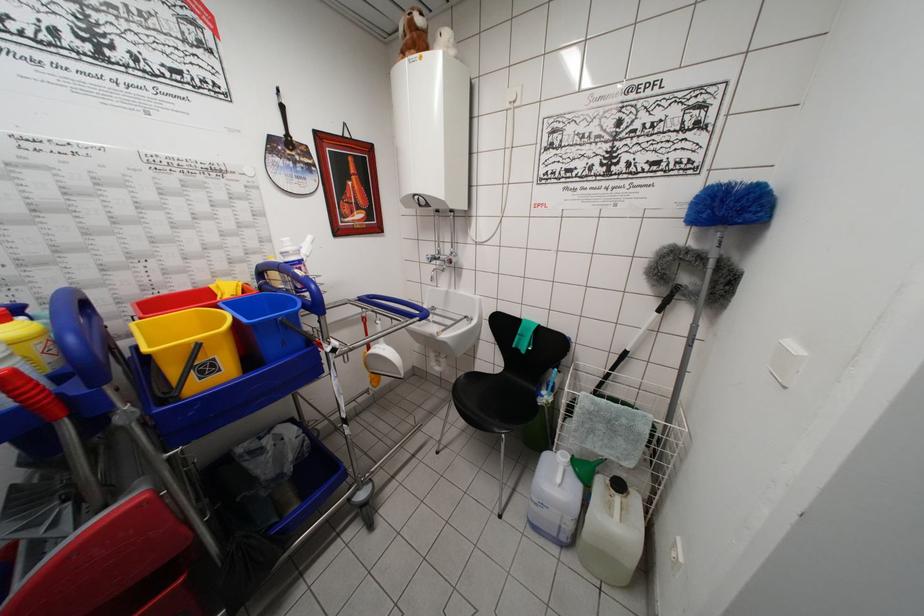
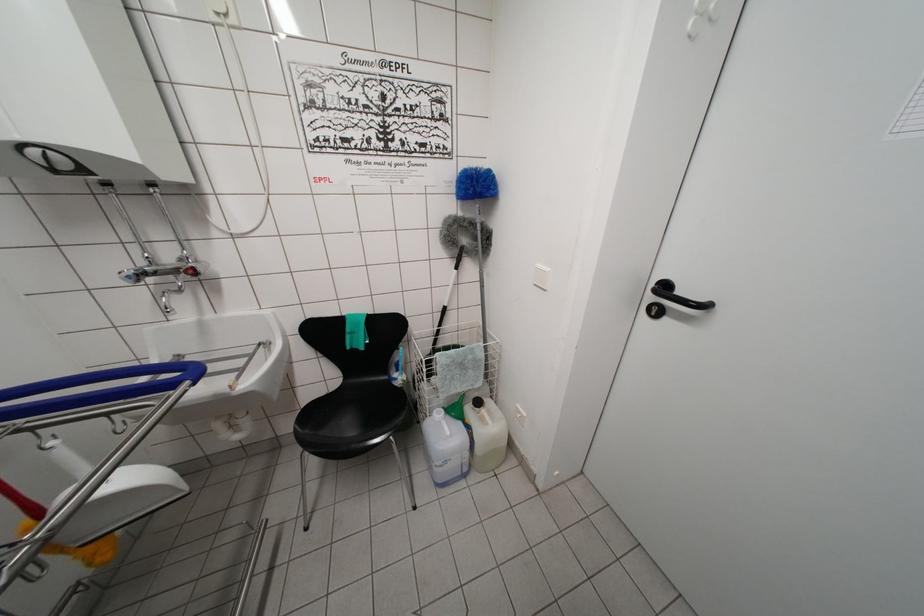
Question: How did the camera likely rotate?

Choices:
 (A) Left
 (B) Right
 (C) Up
 (D) Down

Answer: (B)